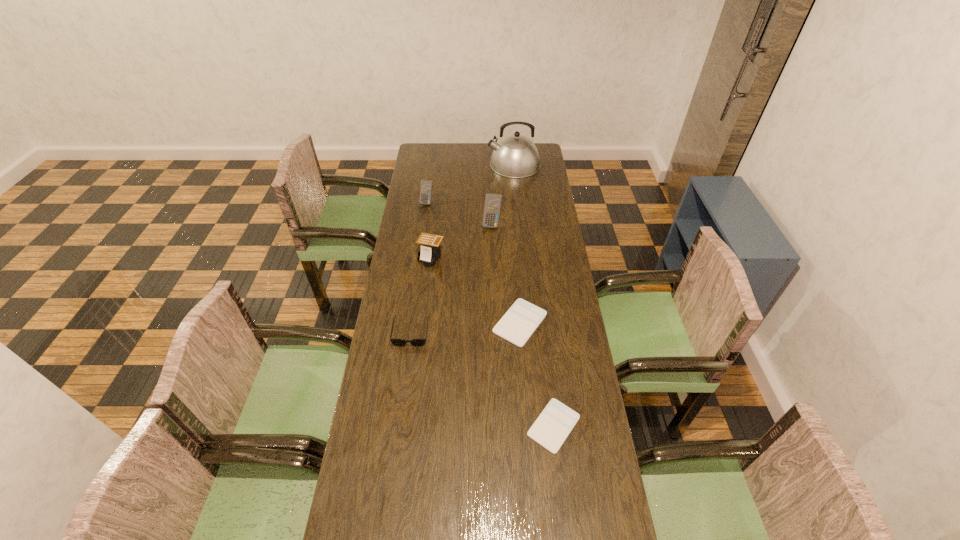
In order to click on the second shortest object in this screenshot , I will do `click(518, 324)`.

In order to click on the farther white calculator in this screenshot , I will do `click(518, 324)`.

Identify the location of the smaller white calculator. The image size is (960, 540). (552, 427).

You are a GUI agent. You are given a task and a screenshot of the screen. Output one action in this format:
    pyautogui.click(x=<x>, y=<y>)
    Task: Click on the shortest calculator
    The image size is (960, 540).
    Given the screenshot: What is the action you would take?
    pyautogui.click(x=552, y=427)

In order to click on vacant point located from the spout of the kettle in this screenshot , I will do `click(431, 164)`.

Identify the location of vacant space located from the spout of the kettle. (471, 164).

The image size is (960, 540). What are the coordinates of `vacant area located 0.240m from the spout of the kettle` in the screenshot? It's located at (444, 164).

The width and height of the screenshot is (960, 540). I want to click on free region located 0.150m on the front-facing side of the second tallest object, so click(x=492, y=253).

What are the coordinates of `free location located 0.390m on the front-facing side of the farthest calculator` in the screenshot? It's located at (419, 262).

Find the location of `vacant space positioned on the right of the fourth farthest object`. vacant space positioned on the right of the fourth farthest object is located at coordinates pyautogui.click(x=508, y=258).